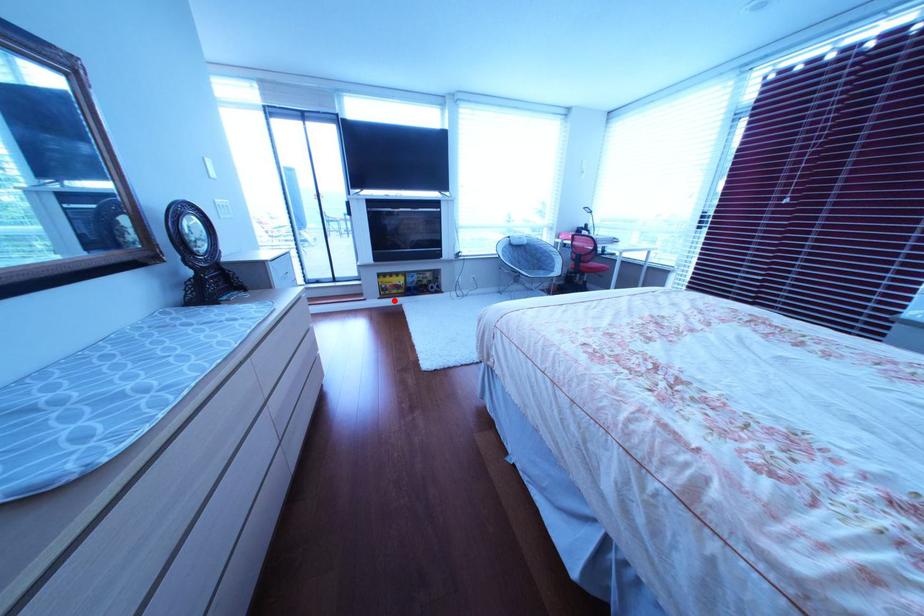
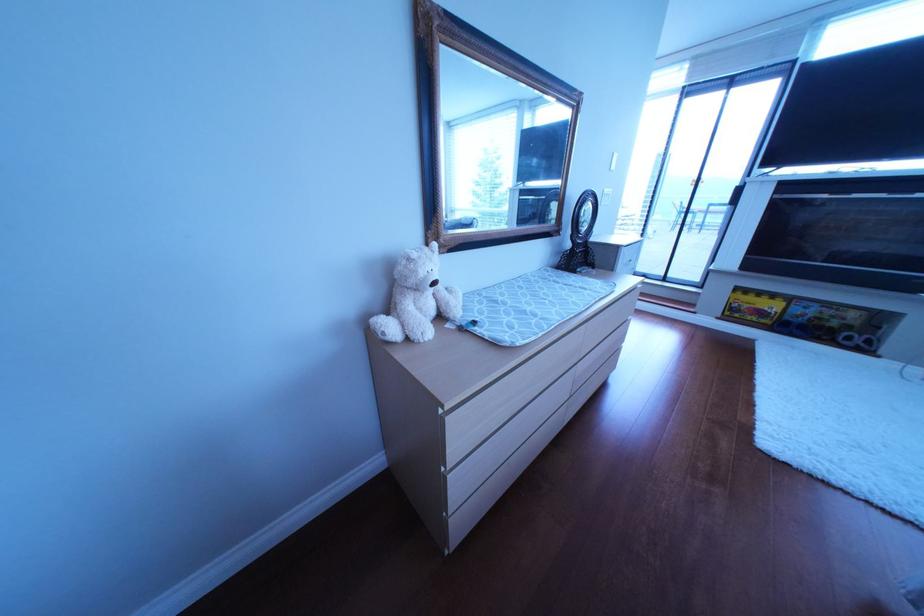
In the second image, find the point that corresponds to the highlighted location in the first image.

(733, 320)